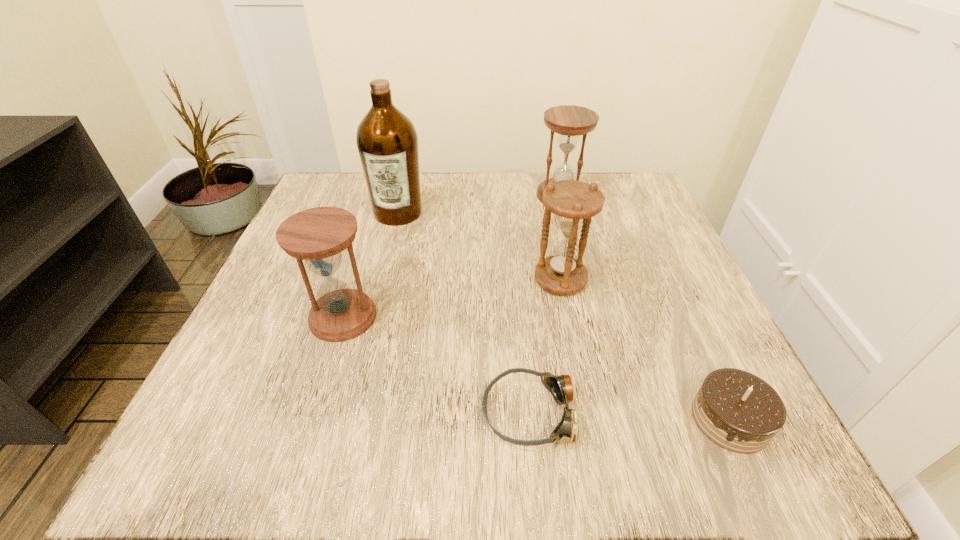
In the image, there is a desktop. At what (x,y) coordinates should I click in order to perform the action: click on free region at the near right corner. Please return your answer as a coordinate pair (x, y). This screenshot has height=540, width=960. Looking at the image, I should click on (680, 411).

Where is `free space that is in between the fifth tallest object and the olive oil`? free space that is in between the fifth tallest object and the olive oil is located at coordinates (564, 316).

Where is `free space between the olive oil and the leftmost hourglass`? The width and height of the screenshot is (960, 540). free space between the olive oil and the leftmost hourglass is located at coordinates (371, 265).

Identify the location of free spot between the goggles and the chocolate cake. The height and width of the screenshot is (540, 960). (631, 416).

What are the coordinates of `empty space between the olive oil and the leftmost hourglass` in the screenshot? It's located at (371, 265).

Where is `free space between the farthest hourglass and the goggles`? This screenshot has height=540, width=960. free space between the farthest hourglass and the goggles is located at coordinates (546, 304).

The width and height of the screenshot is (960, 540). Identify the location of empty space between the leftmost hourglass and the fifth tallest object. pos(537,368).

Find the location of a particular element. This screenshot has height=540, width=960. free space that is in between the goggles and the leftmost hourglass is located at coordinates (437, 364).

Find the location of `unoccupied area between the shortest object and the farthest hourglass`. unoccupied area between the shortest object and the farthest hourglass is located at coordinates (546, 304).

The height and width of the screenshot is (540, 960). What are the coordinates of `free space between the farthest hourglass and the shortest object` in the screenshot? It's located at (546, 304).